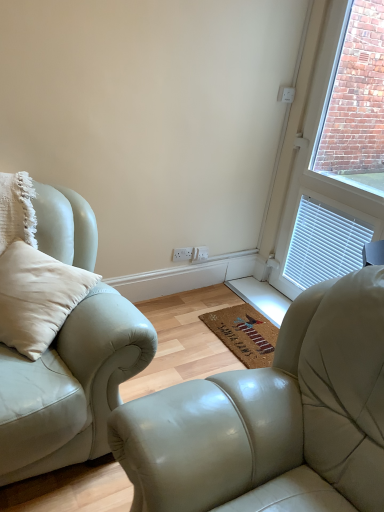
Question: From a real-world perspective, is white textured window at upper right below coir mat at center?

Choices:
 (A) yes
 (B) no

Answer: (B)

Question: Can you see white textured window at upper right touching coir mat at center?

Choices:
 (A) no
 (B) yes

Answer: (A)

Question: Is white textured window at upper right to the left of coir mat at center from the viewer's perspective?

Choices:
 (A) yes
 (B) no

Answer: (B)

Question: Is white textured window at upper right far away from coir mat at center?

Choices:
 (A) yes
 (B) no

Answer: (B)

Question: Does white textured window at upper right turn towards coir mat at center?

Choices:
 (A) yes
 (B) no

Answer: (A)

Question: Is white plastic electric outlet at center taller or shorter than coir mat at center?

Choices:
 (A) short
 (B) tall

Answer: (B)

Question: Does point (185, 259) appear closer or farther from the camera than point (248, 327)?

Choices:
 (A) farther
 (B) closer

Answer: (A)

Question: Is white plastic electric outlet at center bigger or smaller than coir mat at center?

Choices:
 (A) small
 (B) big

Answer: (A)

Question: Would you say white plastic electric outlet at center is inside or outside coir mat at center?

Choices:
 (A) inside
 (B) outside

Answer: (B)

Question: Is point (26, 409) closer or farther from the camera than point (231, 348)?

Choices:
 (A) farther
 (B) closer

Answer: (B)

Question: Is light beige leather couch at left bigger or smaller than coir mat at center?

Choices:
 (A) big
 (B) small

Answer: (A)

Question: From a real-world perspective, is light beige leather couch at left physically located above or below coir mat at center?

Choices:
 (A) below
 (B) above

Answer: (B)

Question: Is light beige leather couch at left taller or shorter than coir mat at center?

Choices:
 (A) tall
 (B) short

Answer: (A)

Question: From a real-world perspective, is light beige leather couch at left positioned above or below white plastic electric outlet at center?

Choices:
 (A) above
 (B) below

Answer: (A)

Question: Is point (145, 366) closer or farther from the camera than point (183, 260)?

Choices:
 (A) closer
 (B) farther

Answer: (A)